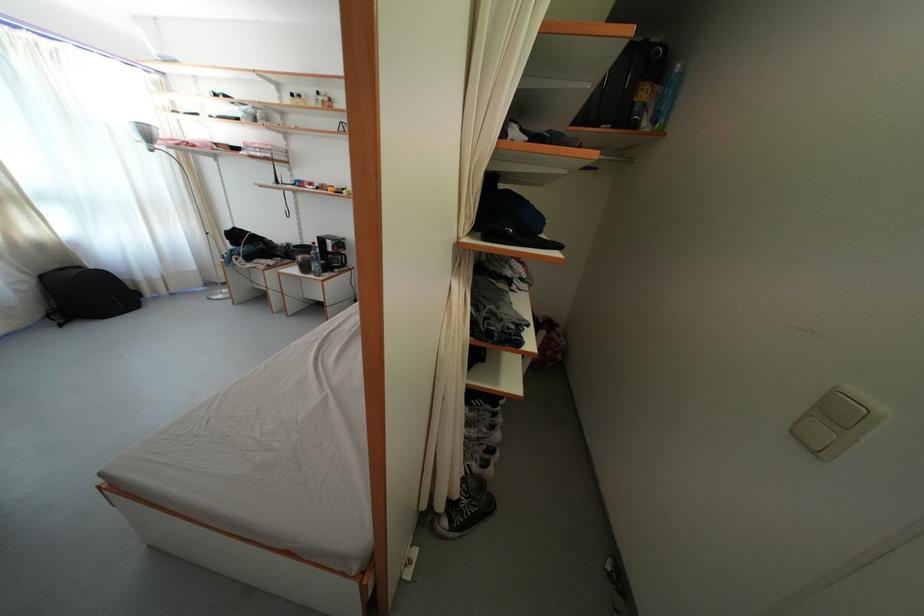
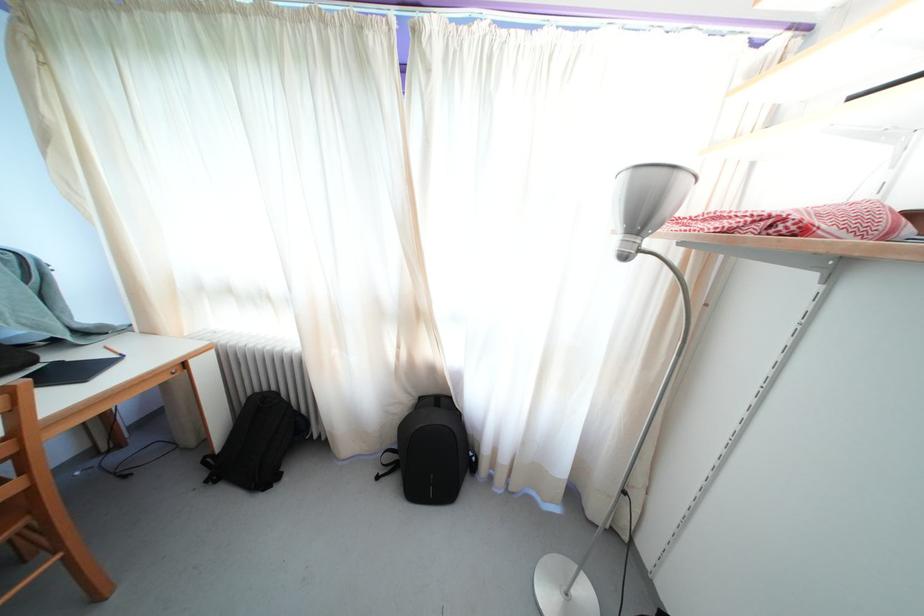
Locate, in the second image, the point that corresponds to (49,283) in the first image.

(427, 405)